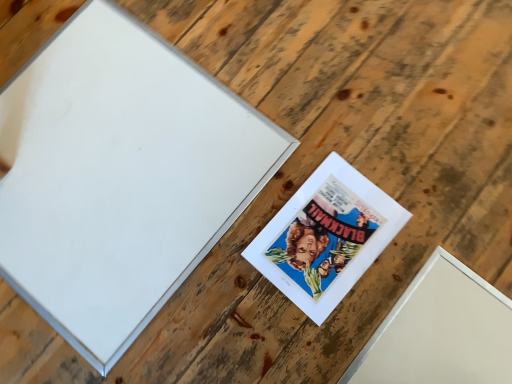
Locate an element on the screen. The image size is (512, 384). vacant space situated above matte paper picture frame at center, arranged as the first picture frame when viewed from the right (from a real-world perspective) is located at coordinates (325, 238).